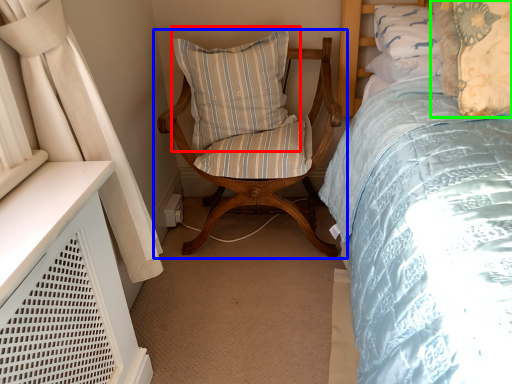
Question: Which object is the farthest from pillow (highlighted by a red box)? Choose among these: chair (highlighted by a blue box) or pillow (highlighted by a green box).

Choices:
 (A) chair
 (B) pillow

Answer: (B)